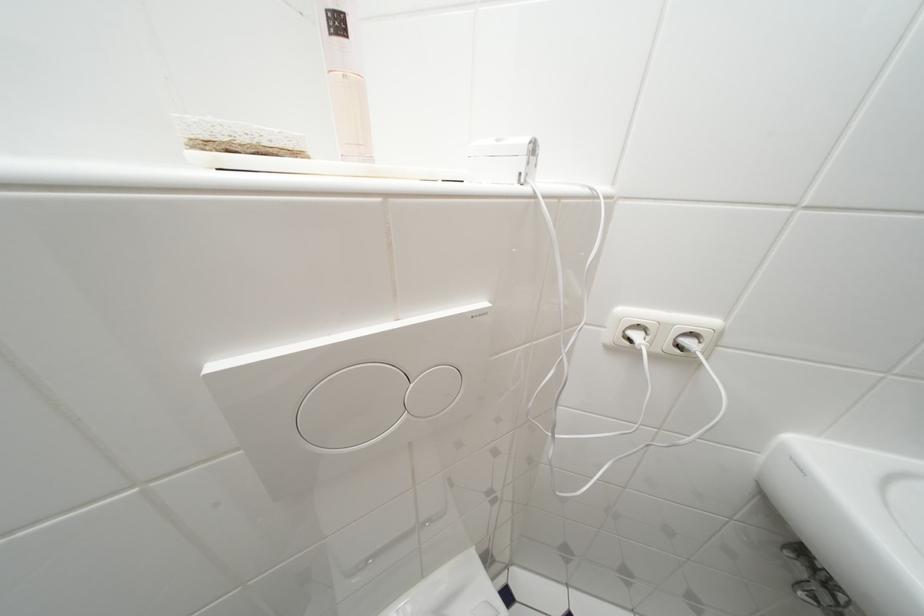
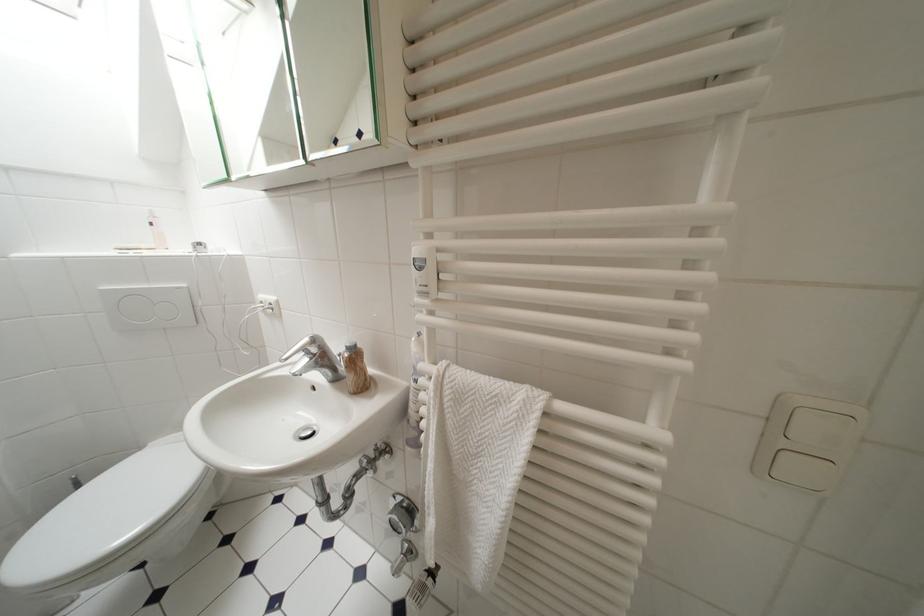
Find the pixel in the second image that matches [345,26] in the first image.

(159, 227)